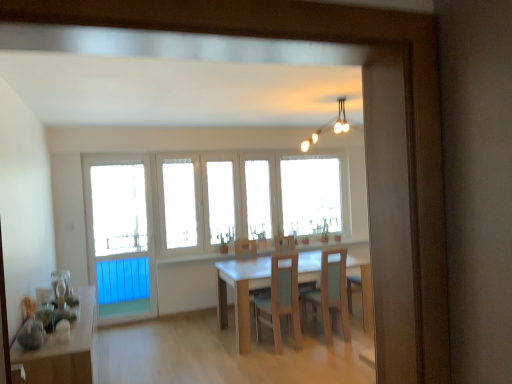
Question: Is light wood chair at center, the 1th chair in the right-to-left sequence, to the right of wooden table at center, positioned as the second table in left-to-right order, from the viewer's perspective?

Choices:
 (A) no
 (B) yes

Answer: (B)

Question: Could you tell me if light wood chair at center, positioned as the 2th chair in left-to-right order, is turned towards wooden table at center, the second table viewed from the front?

Choices:
 (A) yes
 (B) no

Answer: (A)

Question: Is there a large distance between light wood chair at center, positioned as the 2th chair in left-to-right order, and wooden table at center, positioned as the second table in left-to-right order?

Choices:
 (A) no
 (B) yes

Answer: (A)

Question: From the image's perspective, is light wood chair at center, the 1th chair in the right-to-left sequence, below wooden table at center, acting as the first table starting from the back?

Choices:
 (A) yes
 (B) no

Answer: (B)

Question: Considering the relative positions of light wood chair at center, positioned as the 2th chair in left-to-right order, and wooden table at center, the second table viewed from the front, in the image provided, is light wood chair at center, positioned as the 2th chair in left-to-right order, to the left of wooden table at center, the second table viewed from the front, from the viewer's perspective?

Choices:
 (A) yes
 (B) no

Answer: (B)

Question: Does light wood chair at center, the 1th chair in the right-to-left sequence, have a lesser width compared to wooden table at center, positioned as the second table in left-to-right order?

Choices:
 (A) no
 (B) yes

Answer: (B)

Question: Is white glass windows at center facing towards light wood chair at center, the 1th chair in the right-to-left sequence?

Choices:
 (A) yes
 (B) no

Answer: (A)

Question: From the image's perspective, does white glass windows at center appear higher than light wood chair at center, positioned as the 2th chair in left-to-right order?

Choices:
 (A) no
 (B) yes

Answer: (B)

Question: Can you confirm if white glass windows at center is wider than light wood chair at center, the 1th chair in the right-to-left sequence?

Choices:
 (A) no
 (B) yes

Answer: (A)

Question: Is white glass windows at center taller than light wood chair at center, positioned as the 2th chair in left-to-right order?

Choices:
 (A) no
 (B) yes

Answer: (B)

Question: Considering the relative sizes of white glass windows at center and light wood chair at center, the 1th chair in the right-to-left sequence, in the image provided, is white glass windows at center shorter than light wood chair at center, the 1th chair in the right-to-left sequence,?

Choices:
 (A) yes
 (B) no

Answer: (B)

Question: From a real-world perspective, is white glass windows at center on top of light wood chair at center, positioned as the 2th chair in left-to-right order?

Choices:
 (A) yes
 (B) no

Answer: (A)

Question: Could you tell me if light wood chair at center, the 1th chair in the right-to-left sequence, is facing white glass windows at center?

Choices:
 (A) yes
 (B) no

Answer: (A)